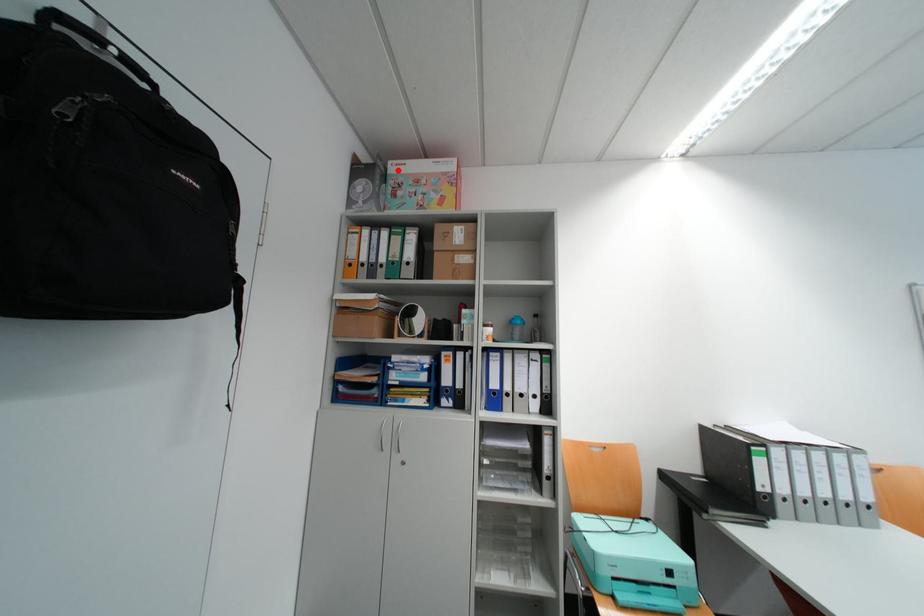
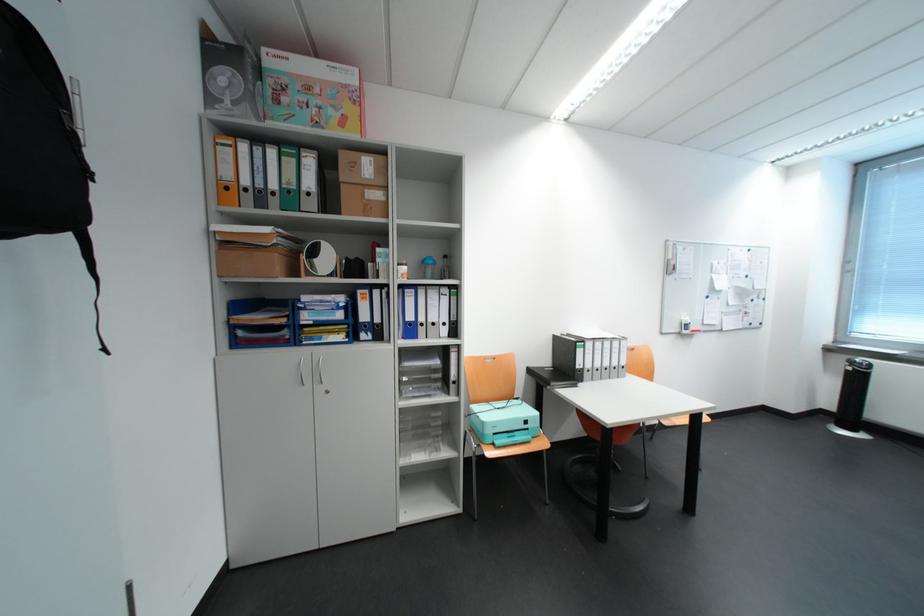
Find the pixel in the second image that matches the highlighted location in the first image.

(272, 60)